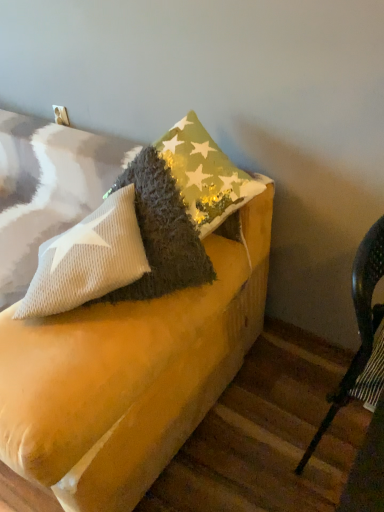
Question: From a real-world perspective, is metallic dark green chair at right on top of velvet yellow couch at center?

Choices:
 (A) no
 (B) yes

Answer: (A)

Question: Does metallic dark green chair at right have a lesser height compared to velvet yellow couch at center?

Choices:
 (A) no
 (B) yes

Answer: (A)

Question: Does metallic dark green chair at right have a lesser width compared to velvet yellow couch at center?

Choices:
 (A) yes
 (B) no

Answer: (A)

Question: From the image's perspective, is metallic dark green chair at right on velvet yellow couch at center?

Choices:
 (A) yes
 (B) no

Answer: (B)

Question: Is velvet yellow couch at center at the back of metallic dark green chair at right?

Choices:
 (A) no
 (B) yes

Answer: (B)

Question: Can you confirm if metallic dark green chair at right is positioned to the left of velvet yellow couch at center?

Choices:
 (A) yes
 (B) no

Answer: (B)

Question: Is velvet yellow couch at center behind metallic dark green chair at right?

Choices:
 (A) yes
 (B) no

Answer: (A)

Question: Does velvet yellow couch at center have a lesser width compared to metallic dark green chair at right?

Choices:
 (A) yes
 (B) no

Answer: (B)

Question: Does velvet yellow couch at center have a smaller size compared to metallic dark green chair at right?

Choices:
 (A) yes
 (B) no

Answer: (B)

Question: From the image's perspective, does velvet yellow couch at center appear higher than metallic dark green chair at right?

Choices:
 (A) no
 (B) yes

Answer: (B)

Question: Considering the relative sizes of velvet yellow couch at center and metallic dark green chair at right in the image provided, is velvet yellow couch at center taller than metallic dark green chair at right?

Choices:
 (A) yes
 (B) no

Answer: (B)

Question: Are velvet yellow couch at center and metallic dark green chair at right beside each other?

Choices:
 (A) yes
 (B) no

Answer: (B)

Question: Is metallic dark green chair at right situated inside velvet yellow couch at center or outside?

Choices:
 (A) inside
 (B) outside

Answer: (B)